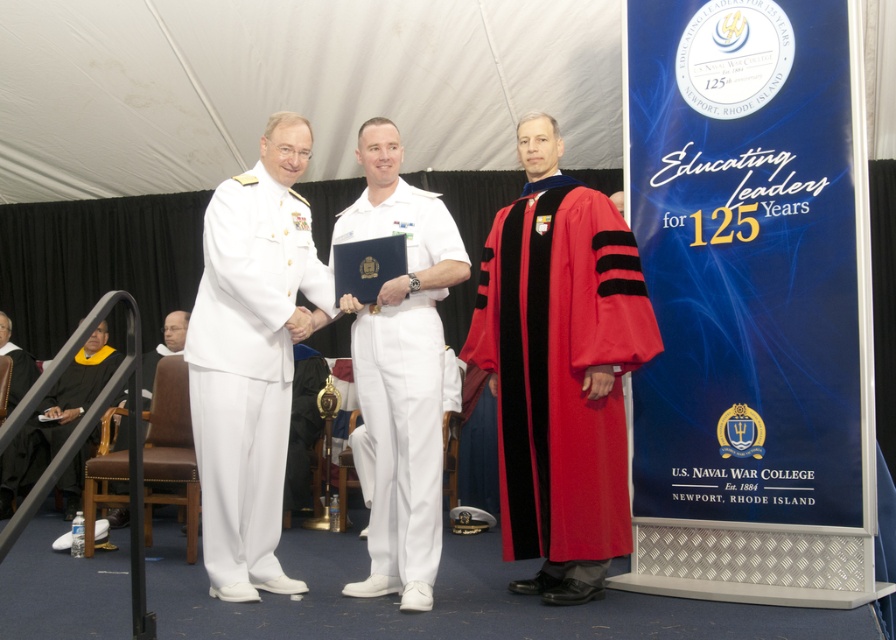
Question: Is red velvet graduation gown at center above white cotton dress uniform at left?

Choices:
 (A) no
 (B) yes

Answer: (B)

Question: Considering the relative positions of red velvet graduation gown at center and white cotton uniform at center in the image provided, where is red velvet graduation gown at center located with respect to white cotton uniform at center?

Choices:
 (A) left
 (B) right

Answer: (B)

Question: Among these objects, which one is farthest from the camera?

Choices:
 (A) white cotton uniform at center
 (B) red velvet graduation gown at center
 (C) black matte graduation gown at lower left

Answer: (C)

Question: Among these points, which one is nearest to the camera?

Choices:
 (A) (6, 355)
 (B) (376, 529)
 (C) (607, 435)
 (D) (102, 346)

Answer: (C)

Question: Considering the relative positions of red velvet graduation gown at center and graduation gown at lower left in the image provided, where is red velvet graduation gown at center located with respect to graduation gown at lower left?

Choices:
 (A) above
 (B) below

Answer: (A)

Question: Which of the following is the closest to the observer?

Choices:
 (A) white cotton uniform at center
 (B) black matte graduation gown at lower left
 (C) red velvet graduation gown at center
 (D) graduation gown at lower left

Answer: (C)